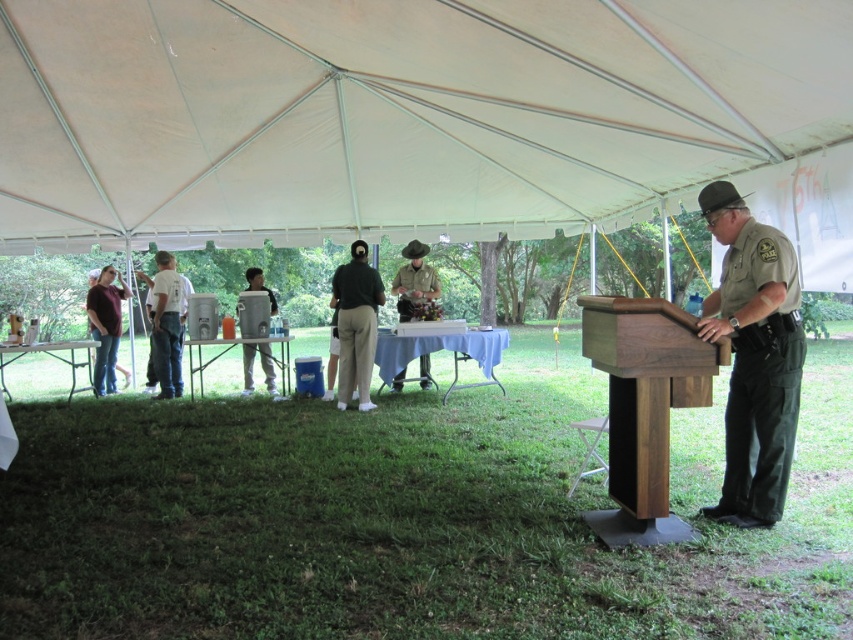
Question: Which point is farther to the camera?

Choices:
 (A) (772, 264)
 (B) (595, 28)

Answer: (B)

Question: Is dark green uniform at left positioned before brushed metal cooler at center?

Choices:
 (A) no
 (B) yes

Answer: (A)

Question: Which of the following is the closest to the observer?

Choices:
 (A) white cotton shirt at left
 (B) dark green uniform at left
 (C) walnut wood podium at right

Answer: (C)

Question: Observing the image, what is the correct spatial positioning of green uniform at right in reference to green fabric uniform at center?

Choices:
 (A) left
 (B) right

Answer: (B)

Question: Considering the relative positions of walnut wood podium at right and green fabric uniform at center in the image provided, where is walnut wood podium at right located with respect to green fabric uniform at center?

Choices:
 (A) left
 (B) right

Answer: (B)

Question: Which point is farther from the camera taking this photo?

Choices:
 (A) (26, 70)
 (B) (416, 289)

Answer: (B)